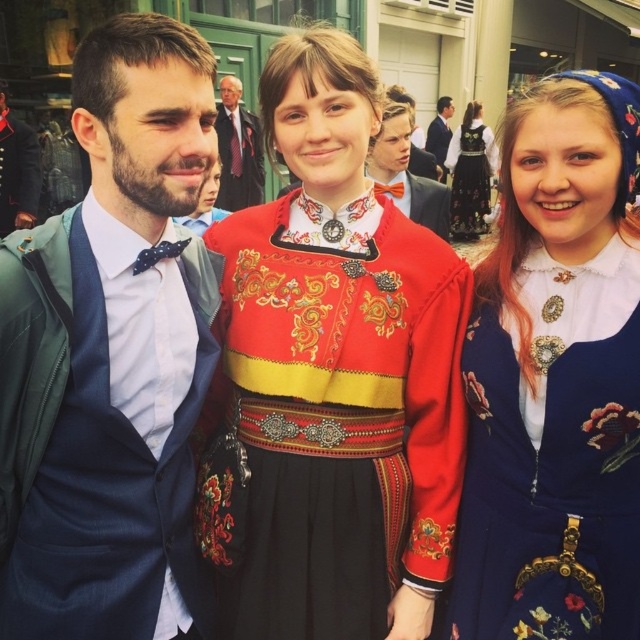
In the scene shown: Does matte blue suit at left have a greater height compared to embroidered velvet dress at center?

No.

Does matte blue suit at left appear under embroidered velvet dress at center?

Yes, matte blue suit at left is below embroidered velvet dress at center.

Looking at this image, measure the distance between matte blue suit at left and camera.

matte blue suit at left and camera are 7.73 feet apart from each other.

Identify the location of matte blue suit at left. (109, 355).

Does matte black suit at upper center have a greater height compared to orange satin bow tie at center?

Correct, matte black suit at upper center is much taller as orange satin bow tie at center.

Who is higher up, matte black suit at upper center or orange satin bow tie at center?

matte black suit at upper center

At what (x,y) coordinates should I click in order to perform the action: click on matte black suit at upper center. Please return your answer as a coordinate pair (x, y). Looking at the image, I should click on (237, 148).

Locate an element on the screen. matte black suit at upper center is located at coordinates (237, 148).

What do you see at coordinates (109, 355) in the screenshot? Image resolution: width=640 pixels, height=640 pixels. I see `matte blue suit at left` at bounding box center [109, 355].

Between matte blue suit at left and velvet military uniform at center, which one appears on the right side from the viewer's perspective?

Positioned to the right is matte blue suit at left.

The width and height of the screenshot is (640, 640). What are the coordinates of `matte blue suit at left` in the screenshot? It's located at (109, 355).